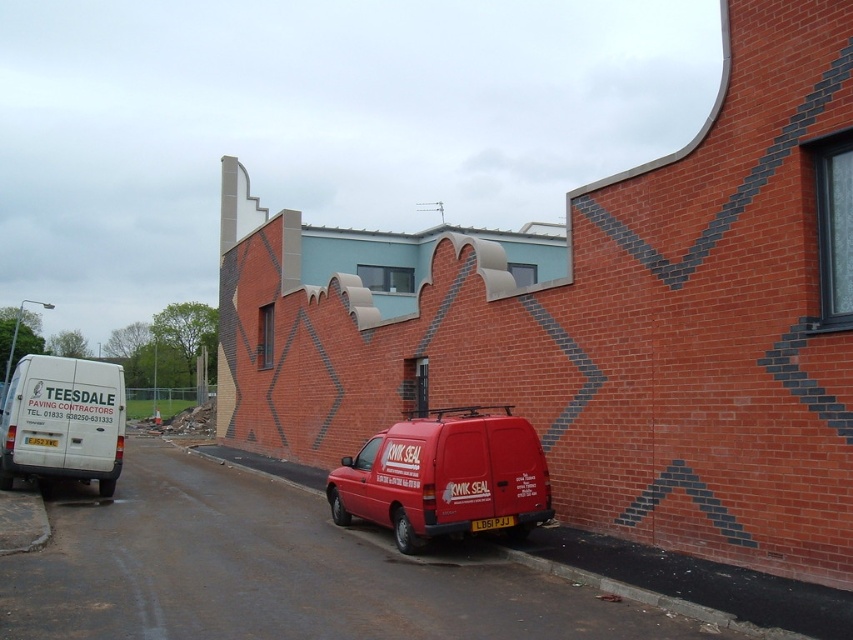
You are standing in front of the building and want to locate the matte red van at center. Which direction should you look relative to the building?

The matte red van at center is located at point (445, 477), which is at the center of the image. So you should look straight ahead towards the center of the building to find it.

You are a delivery driver who needs to park a third van between the matte red van at center and the white matte van at left. The new van is 1.8 meters tall. Can you safely park it there without hitting the roof?

The matte red van at center has a lesser height compared to white matte van at left. Since the new van is 1.8 meters tall, it can safely park between them as long as the height of the lower van is less than 1.8 meters. However, without knowing the exact height of the lower van, it is impossible to confirm if the new van will fit.

You are a delivery driver who needs to park your truck between the matte red van at center and the white matte van at left. Your truck is 6 meters long. Can you fit your truck in the available space between them?

The matte red van at center is smaller than the white matte van at left. However, the distance between them isn not specified in the Objects Description, so we cannot determine if the truck will fit.